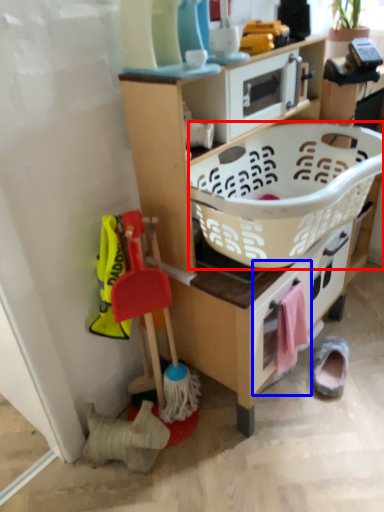
Question: Which object appears farthest to the camera in this image, basket (highlighted by a red box) or drawer (highlighted by a blue box)?

Choices:
 (A) basket
 (B) drawer

Answer: (B)